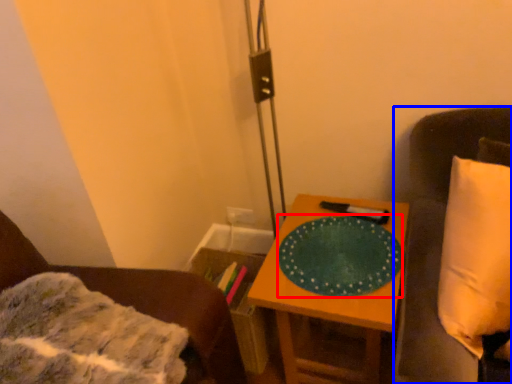
Question: Which object is further to the camera taking this photo, platter (highlighted by a red box) or furniture (highlighted by a blue box)?

Choices:
 (A) platter
 (B) furniture

Answer: (A)